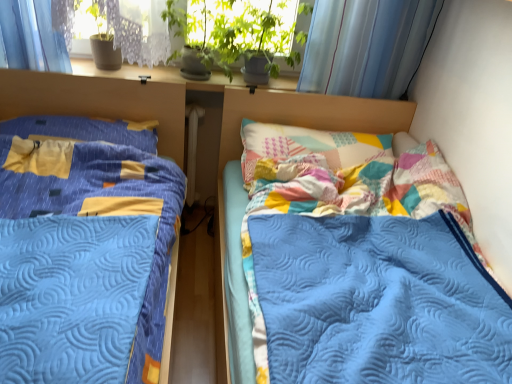
Where is `blue quilted bed at left, acting as the first bed starting from the left`? The height and width of the screenshot is (384, 512). blue quilted bed at left, acting as the first bed starting from the left is located at coordinates (99, 101).

I want to click on yellow fabric pillow at left, so click(x=84, y=130).

Considering the positions of point (25, 90) and point (148, 128), is point (25, 90) closer or farther from the camera than point (148, 128)?

Point (25, 90) is closer to the camera than point (148, 128).

Is blue quilted bed at left, acting as the first bed starting from the left, next to yellow fabric pillow at left and touching it?

blue quilted bed at left, acting as the first bed starting from the left, and yellow fabric pillow at left are not in contact.

Does blue quilted bed at left, acting as the first bed starting from the left, appear on the left side of yellow fabric pillow at left?

No, blue quilted bed at left, acting as the first bed starting from the left, is not to the left of yellow fabric pillow at left.

Measure the distance between yellow fabric pillow at left and quilted blue blanket at center, which appears as the first bed when viewed from the right.

26.77 inches.

Is yellow fabric pillow at left situated inside quilted blue blanket at center, arranged as the second bed when viewed from the left, or outside?

yellow fabric pillow at left is spatially situated outside quilted blue blanket at center, arranged as the second bed when viewed from the left.

Considering the relative sizes of yellow fabric pillow at left and quilted blue blanket at center, which appears as the first bed when viewed from the right, in the image provided, is yellow fabric pillow at left shorter than quilted blue blanket at center, which appears as the first bed when viewed from the right,?

Yes.

From a real-world perspective, who is located higher, quilted blue blanket at center, which appears as the first bed when viewed from the right, or yellow fabric pillow at left?

yellow fabric pillow at left is physically above.

At what (x,y) coordinates should I click in order to perform the action: click on the 1st bed in front of the yellow fabric pillow at left. Please return your answer as a coordinate pair (x, y). This screenshot has width=512, height=384. Looking at the image, I should click on (243, 190).

Which object is more forward, quilted blue blanket at center, which appears as the first bed when viewed from the right, or yellow fabric pillow at left?

Positioned in front is quilted blue blanket at center, which appears as the first bed when viewed from the right.

Who is shorter, yellow fabric pillow at left or white plastic radiator at center?

yellow fabric pillow at left is shorter.

Is yellow fabric pillow at left oriented towards white plastic radiator at center?

No, yellow fabric pillow at left is not oriented towards white plastic radiator at center.

Considering the sizes of objects yellow fabric pillow at left and white plastic radiator at center in the image provided, who is smaller, yellow fabric pillow at left or white plastic radiator at center?

Smaller between the two is white plastic radiator at center.

From the image's perspective, which one is positioned higher, yellow fabric pillow at left or white plastic radiator at center?

yellow fabric pillow at left.

Based on the photo, is white plastic radiator at center wider or thinner than yellow fabric pillow at left?

In the image, white plastic radiator at center appears to be more narrow than yellow fabric pillow at left.

Is white plastic radiator at center positioned far away from yellow fabric pillow at left?

They are positioned close to each other.

Looking at this image, considering the positions of objects white plastic radiator at center and yellow fabric pillow at left in the image provided, who is in front, white plastic radiator at center or yellow fabric pillow at left?

yellow fabric pillow at left is in front.

In terms of size, does white plastic radiator at center appear bigger or smaller than yellow fabric pillow at left?

white plastic radiator at center is smaller than yellow fabric pillow at left.

From a real-world perspective, is white plastic radiator at center above or below quilted blue blanket at center, which appears as the first bed when viewed from the right?

Clearly, from a real-world perspective, white plastic radiator at center is below quilted blue blanket at center, which appears as the first bed when viewed from the right.

Based on the photo, from the image's perspective, which is above, white plastic radiator at center or quilted blue blanket at center, which appears as the first bed when viewed from the right?

From the image's view, white plastic radiator at center is above.

Would you say white plastic radiator at center is outside quilted blue blanket at center, which appears as the first bed when viewed from the right?

white plastic radiator at center lies outside quilted blue blanket at center, which appears as the first bed when viewed from the right,'s area.

Based on their sizes in the image, would you say white plastic radiator at center is bigger or smaller than quilted blue blanket at center, arranged as the second bed when viewed from the left?

Clearly, white plastic radiator at center is smaller in size than quilted blue blanket at center, arranged as the second bed when viewed from the left.

From a real-world perspective, which is physically above, blue quilted bed at left, acting as the first bed starting from the left, or white plastic radiator at center?

In real-world perspective, blue quilted bed at left, acting as the first bed starting from the left, is above.

Can you confirm if blue quilted bed at left, which is counted as the 2th bed, starting from the right, is smaller than white plastic radiator at center?

No.

You are a GUI agent. You are given a task and a screenshot of the screen. Output one action in this format:
    pyautogui.click(x=<x>, y=<y>)
    Task: Click on the radiator that appears on the right of blue quilted bed at left, acting as the first bed starting from the left
    This screenshot has height=384, width=512.
    Given the screenshot: What is the action you would take?
    pyautogui.click(x=192, y=148)

Which is more to the left, blue quilted bed at left, which is counted as the 2th bed, starting from the right, or white plastic radiator at center?

Positioned to the left is blue quilted bed at left, which is counted as the 2th bed, starting from the right.

Where is `pillow behind the blue quilted bed at left, acting as the first bed starting from the left`? The image size is (512, 384). pillow behind the blue quilted bed at left, acting as the first bed starting from the left is located at coordinates (84, 130).

You are a GUI agent. You are given a task and a screenshot of the screen. Output one action in this format:
    pyautogui.click(x=<x>, y=<y>)
    Task: Click on the pillow that appears above the quilted blue blanket at center, arranged as the second bed when viewed from the left (from a real-world perspective)
    
    Given the screenshot: What is the action you would take?
    pyautogui.click(x=84, y=130)

Looking at the image, which one is located closer to yellow fabric pillow at left, quilted blue blanket at center, arranged as the second bed when viewed from the left, or blue quilted bed at left, acting as the first bed starting from the left?

Based on the image, blue quilted bed at left, acting as the first bed starting from the left, appears to be nearer to yellow fabric pillow at left.

Considering their positions, is yellow fabric pillow at left positioned further to white plastic radiator at center than quilted blue blanket at center, arranged as the second bed when viewed from the left?

The object further to white plastic radiator at center is quilted blue blanket at center, arranged as the second bed when viewed from the left.

When comparing their distances from yellow fabric pillow at left, does blue quilted bed at left, acting as the first bed starting from the left, or quilted blue blanket at center, which appears as the first bed when viewed from the right, seem further?

quilted blue blanket at center, which appears as the first bed when viewed from the right, is positioned further to the anchor yellow fabric pillow at left.

When comparing their distances from quilted blue blanket at center, arranged as the second bed when viewed from the left, does blue quilted bed at left, acting as the first bed starting from the left, or yellow fabric pillow at left seem closer?

blue quilted bed at left, acting as the first bed starting from the left.

Considering their positions, is white plastic radiator at center positioned further to quilted blue blanket at center, which appears as the first bed when viewed from the right, than yellow fabric pillow at left?

The object further to quilted blue blanket at center, which appears as the first bed when viewed from the right, is yellow fabric pillow at left.

Which object lies nearer to the anchor point blue quilted bed at left, which is counted as the 2th bed, starting from the right, white plastic radiator at center or quilted blue blanket at center, which appears as the first bed when viewed from the right?

Based on the image, white plastic radiator at center appears to be nearer to blue quilted bed at left, which is counted as the 2th bed, starting from the right.

From the image, which object appears to be nearer to quilted blue blanket at center, arranged as the second bed when viewed from the left, yellow fabric pillow at left or blue quilted bed at left, acting as the first bed starting from the left?

Based on the image, blue quilted bed at left, acting as the first bed starting from the left, appears to be nearer to quilted blue blanket at center, arranged as the second bed when viewed from the left.

Based on the photo, considering their positions, is quilted blue blanket at center, which appears as the first bed when viewed from the right, positioned further to white plastic radiator at center than blue quilted bed at left, acting as the first bed starting from the left?

quilted blue blanket at center, which appears as the first bed when viewed from the right.

Identify the location of pillow between quilted blue blanket at center, arranged as the second bed when viewed from the left, and white plastic radiator at center from front to back. This screenshot has height=384, width=512. (84, 130).

Locate an element on the screen. bed located between blue quilted bed at left, which is counted as the 2th bed, starting from the right, and white plastic radiator at center in the depth direction is located at coordinates (243, 190).

I want to click on pillow positioned between blue quilted bed at left, acting as the first bed starting from the left, and white plastic radiator at center from near to far, so click(84, 130).

The height and width of the screenshot is (384, 512). What are the coordinates of `bed situated between yellow fabric pillow at left and quilted blue blanket at center, arranged as the second bed when viewed from the left, from left to right` in the screenshot? It's located at (99, 101).